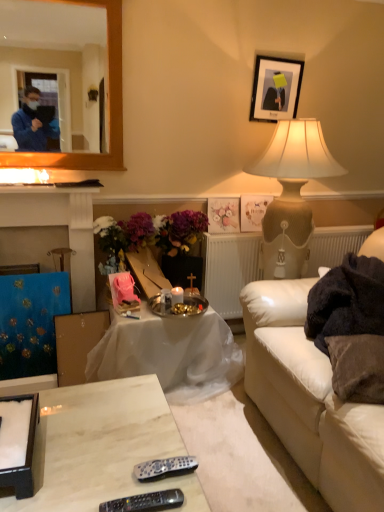
The height and width of the screenshot is (512, 384). Find the location of `free point behind silver metallic remote at lower center, which ranks as the second remote in front-to-back order`. free point behind silver metallic remote at lower center, which ranks as the second remote in front-to-back order is located at coordinates pos(154,440).